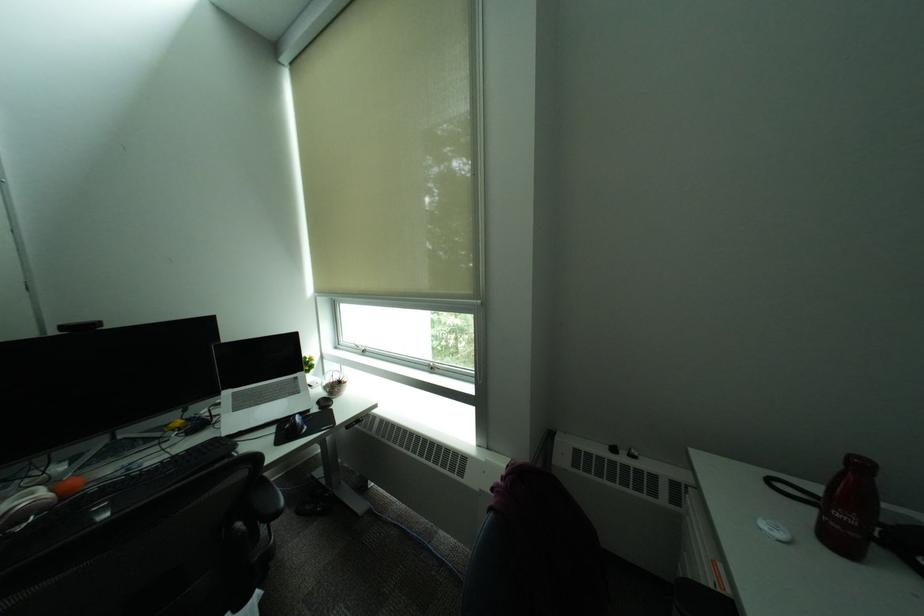
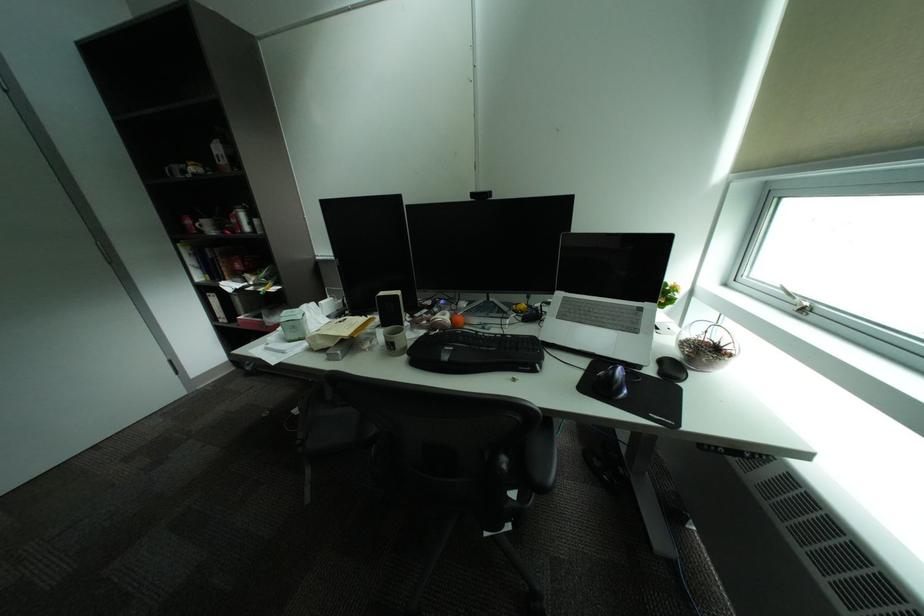
Locate, in the second image, the point that corresponds to [310,429] in the first image.

(626, 389)